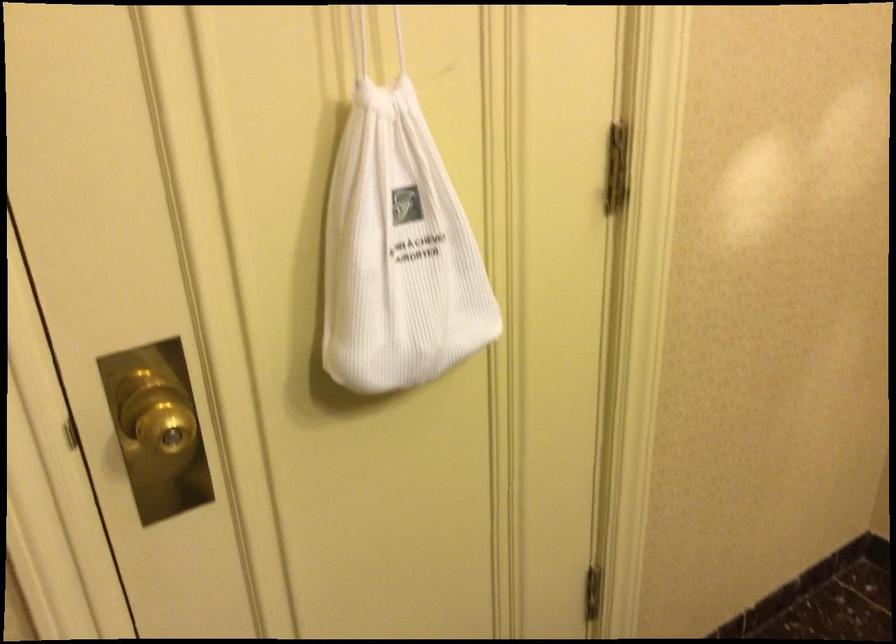
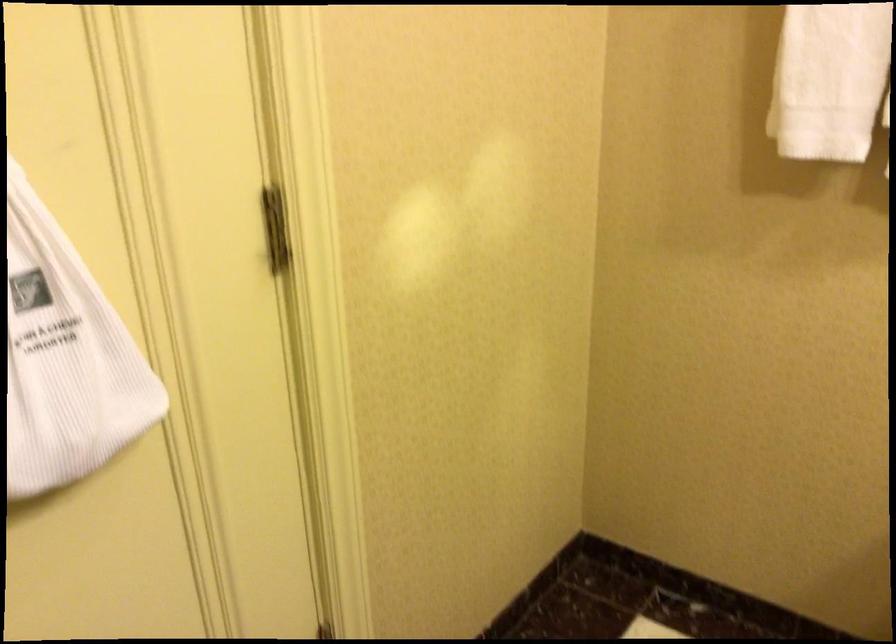
The point at (419, 272) is marked in the first image. Where is the corresponding point in the second image?

(65, 357)